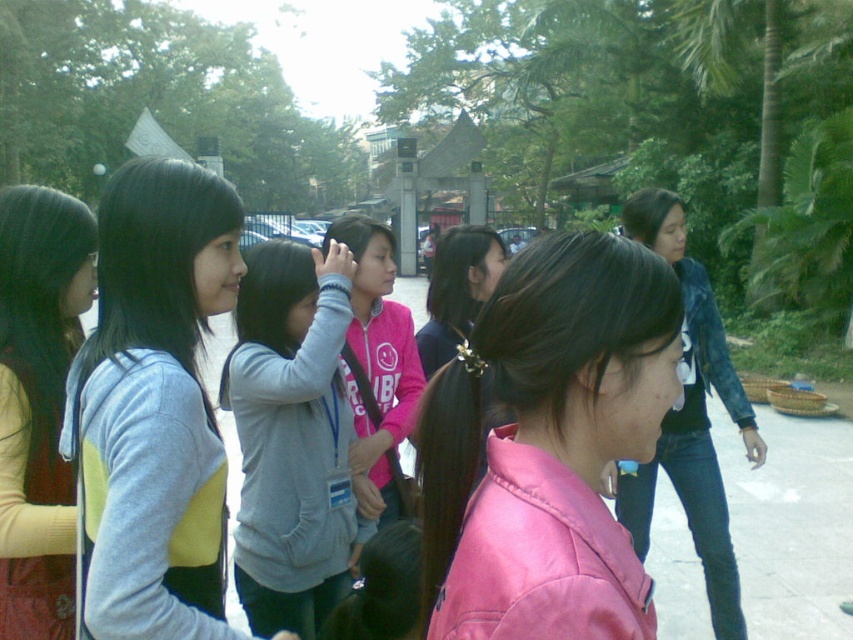
Who is more forward, (x=151, y=560) or (x=735, y=600)?

Point (x=151, y=560)

Does point (144, 394) come behind point (701, 323)?

No, it is not.

Identify the location of light blue fleece jacket at left. The height and width of the screenshot is (640, 853). (154, 397).

Can you confirm if light blue fleece jacket at left is positioned above matte yellow sweater at left?

No, light blue fleece jacket at left is not above matte yellow sweater at left.

Can you confirm if light blue fleece jacket at left is smaller than matte yellow sweater at left?

Yes.

The image size is (853, 640). What are the coordinates of `light blue fleece jacket at left` in the screenshot? It's located at (154, 397).

Image resolution: width=853 pixels, height=640 pixels. Find the location of `light blue fleece jacket at left`. light blue fleece jacket at left is located at coordinates (154, 397).

Which is above, pink leather jacket at center or light blue fleece jacket at left?

light blue fleece jacket at left is above.

Is pink leather jacket at center wider than light blue fleece jacket at left?

No.

The image size is (853, 640). In order to click on pink leather jacket at center in this screenshot , I will do `click(548, 445)`.